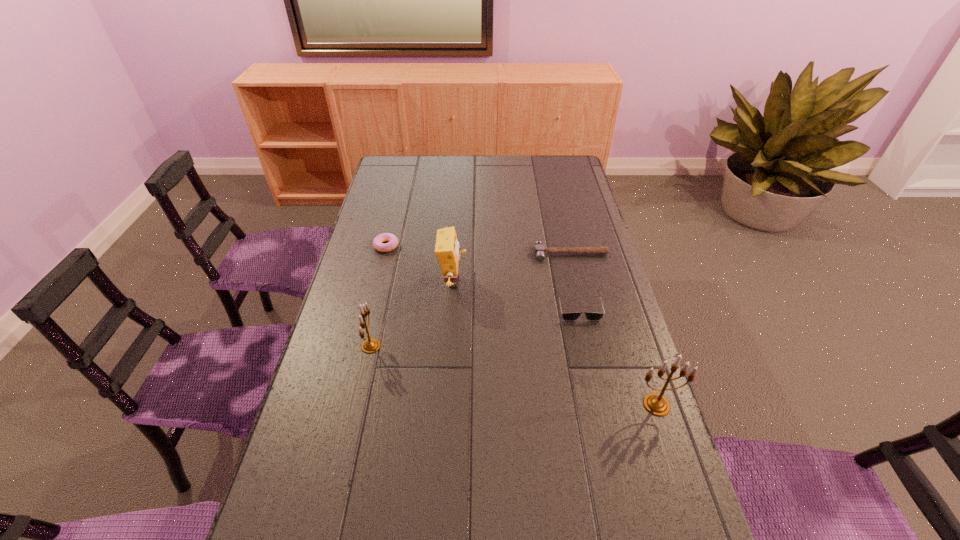
Where is `the left candelabrum`? the left candelabrum is located at coordinates (370, 345).

Where is `the shorter candelabrum`? This screenshot has height=540, width=960. the shorter candelabrum is located at coordinates (370, 345).

This screenshot has width=960, height=540. I want to click on the nearest object, so click(655, 403).

Identify the location of the nearer candelabrum. This screenshot has height=540, width=960. (655, 403).

Identify the location of the fourth object from right to left. pos(447,252).

At what (x,y) coordinates should I click in order to perform the action: click on sunglasses. Please return your answer as a coordinate pair (x, y). The image size is (960, 540). Looking at the image, I should click on (590, 316).

Identify the location of hammer. (539, 250).

Image resolution: width=960 pixels, height=540 pixels. I want to click on doughnut, so click(x=392, y=240).

Where is `vacant point located 0.350m on the front of the second nearest object`? vacant point located 0.350m on the front of the second nearest object is located at coordinates (339, 488).

This screenshot has width=960, height=540. What are the coordinates of `vacant space located 0.320m on the left of the right candelabrum` in the screenshot? It's located at (509, 404).